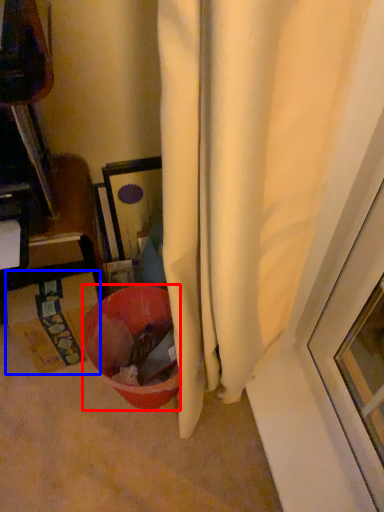
Question: Which of the following is the closest to the observer, bowl (highlighted by a red box) or cardboard box (highlighted by a blue box)?

Choices:
 (A) bowl
 (B) cardboard box

Answer: (A)